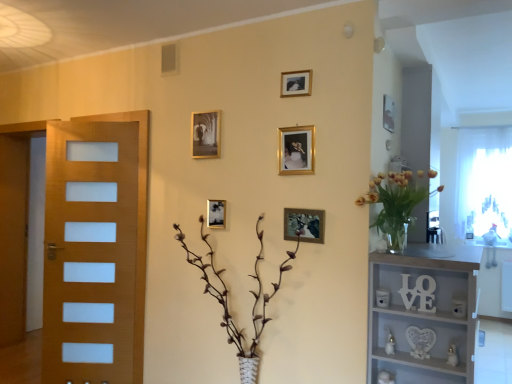
Question: Would you say brown textured plant at center is outside white sheer curtain at right?

Choices:
 (A) yes
 (B) no

Answer: (A)

Question: From the image's perspective, would you say brown textured plant at center is shown under white sheer curtain at right?

Choices:
 (A) yes
 (B) no

Answer: (A)

Question: Is the depth of brown textured plant at center greater than that of white sheer curtain at right?

Choices:
 (A) yes
 (B) no

Answer: (B)

Question: Can you confirm if brown textured plant at center is thinner than white sheer curtain at right?

Choices:
 (A) no
 (B) yes

Answer: (A)

Question: Considering the relative sizes of brown textured plant at center and white sheer curtain at right in the image provided, is brown textured plant at center bigger than white sheer curtain at right?

Choices:
 (A) yes
 (B) no

Answer: (A)

Question: From the image's perspective, relative to white matte shelf at right, is gold metallic picture frame at upper center, arranged as the sixth picture frame when viewed from the left, above or below?

Choices:
 (A) above
 (B) below

Answer: (A)

Question: Visually, is gold metallic picture frame at upper center, arranged as the sixth picture frame when viewed from the left, positioned to the left or to the right of white matte shelf at right?

Choices:
 (A) left
 (B) right

Answer: (A)

Question: Considering the positions of point (394, 107) and point (409, 302), is point (394, 107) closer or farther from the camera than point (409, 302)?

Choices:
 (A) farther
 (B) closer

Answer: (A)

Question: From a real-world perspective, is gold metallic picture frame at upper center, arranged as the sixth picture frame when viewed from the left, above or below white matte shelf at right?

Choices:
 (A) above
 (B) below

Answer: (A)

Question: From a real-world perspective, relative to white sheer curtain at right, is metallic gold picture frame at center, arranged as the 5th picture frame when viewed from the right, vertically above or below?

Choices:
 (A) above
 (B) below

Answer: (B)

Question: In terms of size, does metallic gold picture frame at center, arranged as the 5th picture frame when viewed from the right, appear bigger or smaller than white sheer curtain at right?

Choices:
 (A) big
 (B) small

Answer: (B)

Question: Considering their positions, is metallic gold picture frame at center, arranged as the second picture frame when viewed from the left, located in front of or behind white sheer curtain at right?

Choices:
 (A) behind
 (B) front

Answer: (B)

Question: Considering the positions of metallic gold picture frame at center, arranged as the second picture frame when viewed from the left, and white sheer curtain at right in the image, is metallic gold picture frame at center, arranged as the second picture frame when viewed from the left, taller or shorter than white sheer curtain at right?

Choices:
 (A) tall
 (B) short

Answer: (B)

Question: Considering the positions of brown textured plant at center and gold metallic picture frame at upper center, arranged as the sixth picture frame when viewed from the left, in the image, is brown textured plant at center wider or thinner than gold metallic picture frame at upper center, arranged as the sixth picture frame when viewed from the left,?

Choices:
 (A) wide
 (B) thin

Answer: (A)

Question: From the image's perspective, is brown textured plant at center above or below gold metallic picture frame at upper center, which ranks as the 1th picture frame in right-to-left order?

Choices:
 (A) below
 (B) above

Answer: (A)